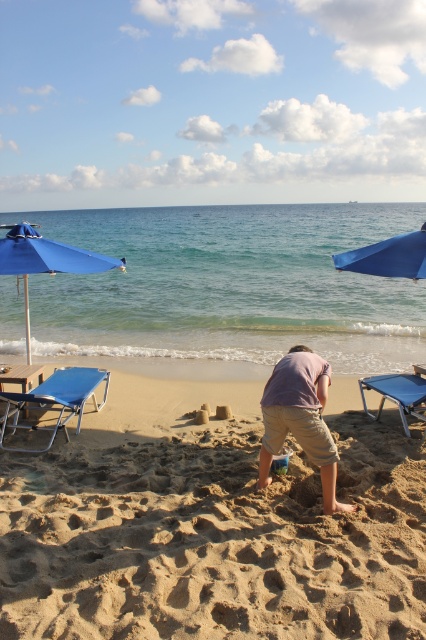
You are a photographer wanting to capture a shot of the pink cotton shirt at center and the blue fabric beach chair at lower right in the same frame. Based on their positions, which object is closer to the left side of the image?

The pink cotton shirt at center is positioned to the left of the blue fabric beach chair at lower right, so it is closer to the left side of the image.

Consider the image. You are a beachgoer who wants to choose the bigger umbrella for shade. Which one between the blue fabric umbrella at upper center and the blue fabric umbrella at right should you pick?

The blue fabric umbrella at upper center is larger in size compared to the blue fabric umbrella at right, so you should pick the blue fabric umbrella at upper center for shade.

You are a photographer standing at the point with coordinates (299,417). What is the color of the clothing item located exactly at your current position?

The pink cotton shirt at center is located at point (299,417), so the color of the clothing item at that position is pink.